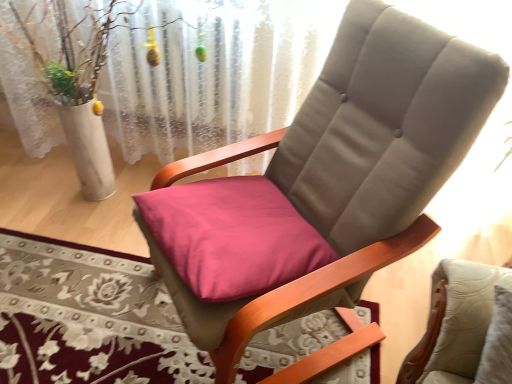
Question: Is pink fabric cushion at center facing towards suede-like beige chair at center?

Choices:
 (A) no
 (B) yes

Answer: (B)

Question: Is pink fabric cushion at center positioned far away from suede-like beige chair at center?

Choices:
 (A) yes
 (B) no

Answer: (B)

Question: Does pink fabric cushion at center come in front of suede-like beige chair at center?

Choices:
 (A) no
 (B) yes

Answer: (A)

Question: Is pink fabric cushion at center located outside suede-like beige chair at center?

Choices:
 (A) yes
 (B) no

Answer: (B)

Question: Considering the relative positions of pink fabric cushion at center and suede-like beige chair at center in the image provided, is pink fabric cushion at center behind suede-like beige chair at center?

Choices:
 (A) yes
 (B) no

Answer: (A)

Question: Does point (243, 82) appear closer or farther from the camera than point (411, 44)?

Choices:
 (A) farther
 (B) closer

Answer: (A)

Question: Is white lace curtain at upper center taller or shorter than suede-like beige chair at center?

Choices:
 (A) short
 (B) tall

Answer: (B)

Question: Based on their sizes in the image, would you say white lace curtain at upper center is bigger or smaller than suede-like beige chair at center?

Choices:
 (A) big
 (B) small

Answer: (B)

Question: Is white lace curtain at upper center wider or thinner than suede-like beige chair at center?

Choices:
 (A) wide
 (B) thin

Answer: (B)

Question: Based on their positions, is suede-like beige chair at center located to the left or right of pink fabric cushion at center?

Choices:
 (A) left
 (B) right

Answer: (B)

Question: Is suede-like beige chair at center wider or thinner than pink fabric cushion at center?

Choices:
 (A) thin
 (B) wide

Answer: (B)

Question: Is point (331, 195) closer or farther from the camera than point (131, 336)?

Choices:
 (A) closer
 (B) farther

Answer: (A)

Question: From their relative heights in the image, would you say suede-like beige chair at center is taller or shorter than pink fabric cushion at center?

Choices:
 (A) short
 (B) tall

Answer: (B)

Question: Visually, is suede-like beige chair at center positioned to the left or to the right of white lace curtain at upper center?

Choices:
 (A) right
 (B) left

Answer: (A)

Question: Considering the positions of suede-like beige chair at center and white lace curtain at upper center in the image, is suede-like beige chair at center taller or shorter than white lace curtain at upper center?

Choices:
 (A) short
 (B) tall

Answer: (A)